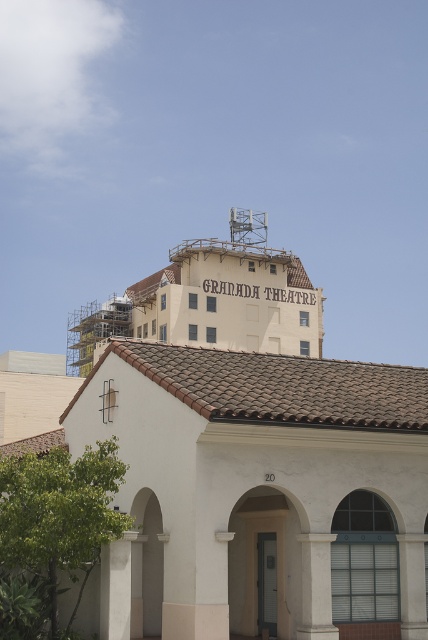
You are standing in front of the Spanish Colonial Revival building and want to take a photo. There are two points marked on your viewfinder at coordinates point (x=315, y=609) and point (x=110, y=604). Which point is closer to you?

Point (x=110, y=604) is closer to you because it is not as far as point (x=315, y=609) which is further away according to the description.

You are an architect inspecting the building facade. You notice the white stone column at center and the white concrete pillar at lower left. Which one has a smaller diameter?

The white stone column at center has a smaller diameter than the white concrete pillar at lower left.